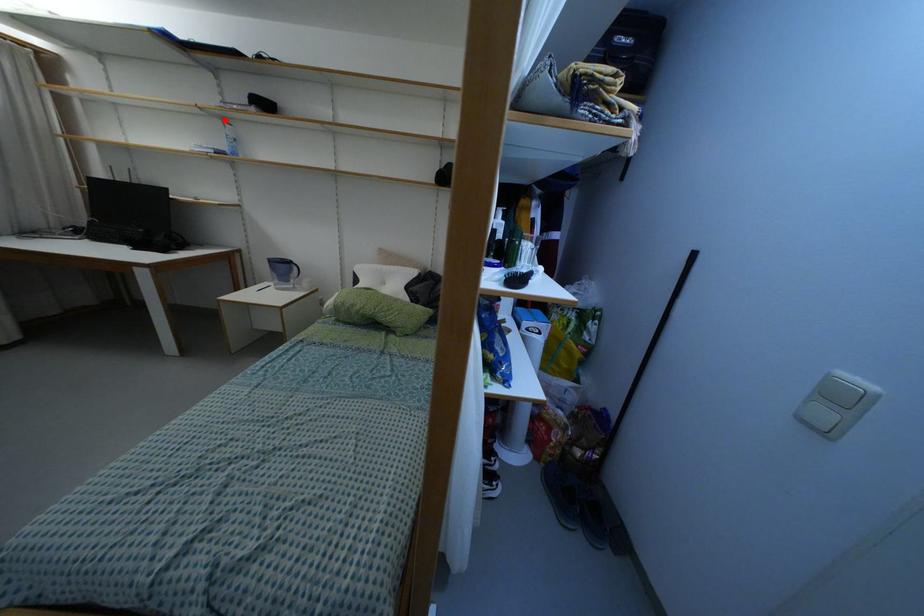
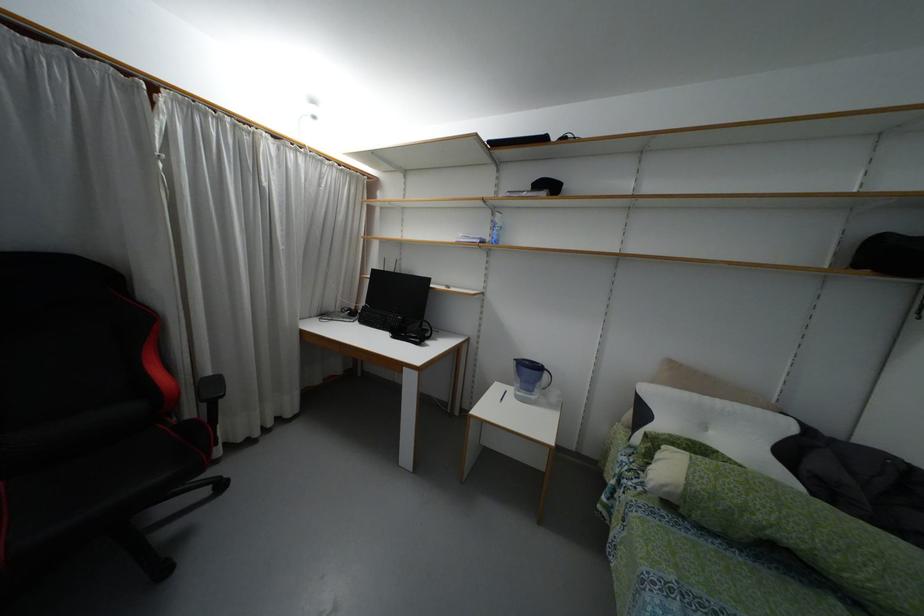
Where in the second image is the point corresponding to the highlighted location from the first image?

(493, 209)